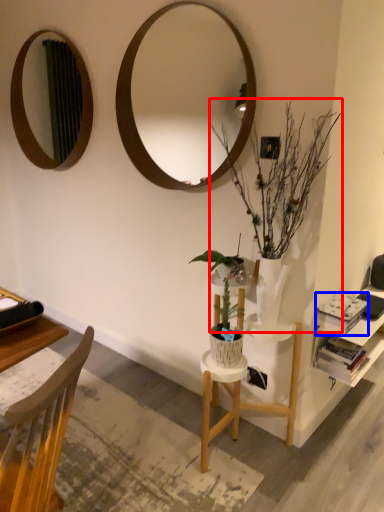
Question: Which point is further to the camera, houseplant (highlighted by a red box) or book (highlighted by a blue box)?

Choices:
 (A) houseplant
 (B) book

Answer: (B)